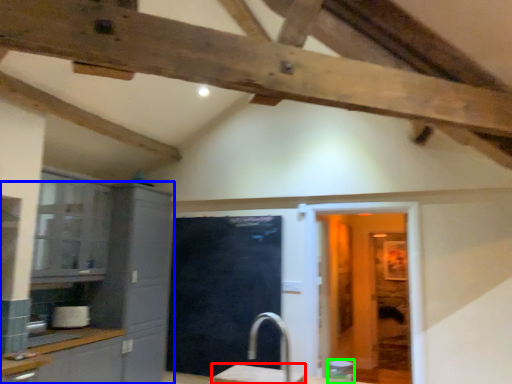
Question: Based on their relative distances, which object is nearer to table (highlighted by a red box)? Choose from cabinetry (highlighted by a blue box) and appliance (highlighted by a green box).

Choices:
 (A) cabinetry
 (B) appliance

Answer: (A)